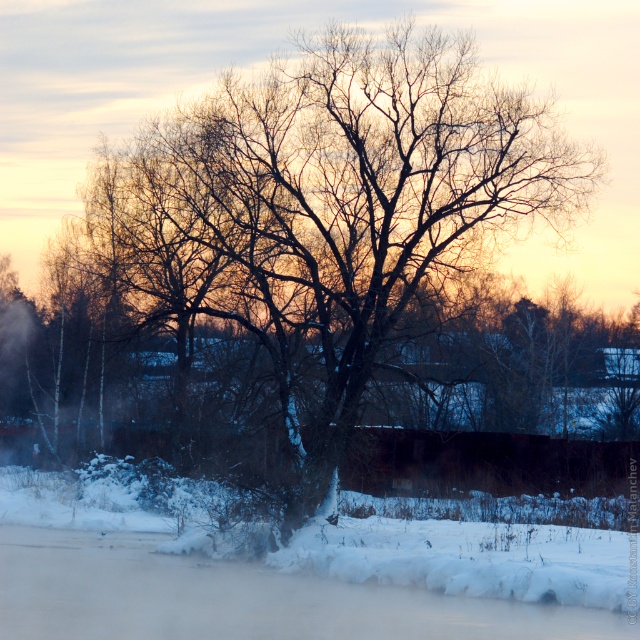
You are standing in the winter scene and want to walk from point A to point B. Point A is at coordinates point (284, 332) and point B is at coordinates point (81, 577). Which point is closer to you when you start walking?

Point A at coordinates point (284, 332) is closer to you because it is further to the viewer than point B at coordinates point (81, 577).

You are standing in the winter scene and want to take a photo of the bare branches at center. Where should you aim your camera to capture them?

You should aim your camera at point 0.369 on the x axis and 0.481 on the y axis to capture the bare branches at center.

You are an artist trying to paint this winter scene. You want to ensure the bare branches at center and the white fluffy snow at lower center are proportionally accurate. Which object should you paint larger?

The bare branches at center should be painted larger since they are larger in size compared to the white fluffy snow at lower center according to the description.